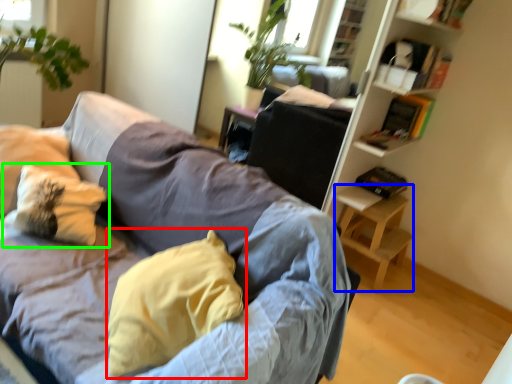
Question: Estimate the real-world distances between objects in this image. Which object is farther from pillow (highlighted by a red box), table (highlighted by a blue box) or pillow (highlighted by a green box)?

Choices:
 (A) table
 (B) pillow

Answer: (A)